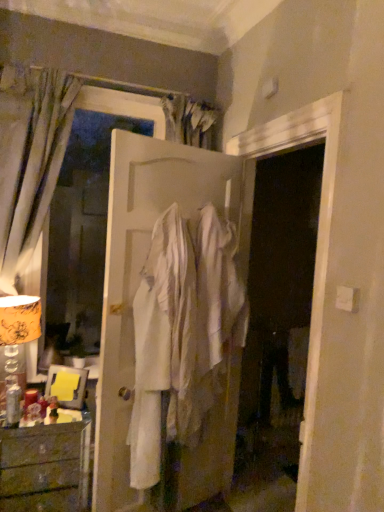
Identify the location of wooden chest of drawers at lower left. (45, 467).

You are a GUI agent. You are given a task and a screenshot of the screen. Output one action in this format:
    pyautogui.click(x=<x>, y=<y>)
    Task: Click on the gold-patterned fabric lampshade at left
    
    Given the screenshot: What is the action you would take?
    pyautogui.click(x=18, y=326)

Consider the image. How many degrees apart are the facing directions of gold-patterned fabric lampshade at left and white matte door at center?

The angular difference between gold-patterned fabric lampshade at left and white matte door at center is 17.2 degrees.

From a real-world perspective, which object rests below the other?

gold-patterned fabric lampshade at left.

Which is farther from the camera, (10, 357) or (203, 187)?

The point (10, 357) is behind.

Considering the positions of objects gold-patterned fabric lampshade at left and white matte door at center in the image provided, who is more to the right, gold-patterned fabric lampshade at left or white matte door at center?

white matte door at center is more to the right.

How many degrees apart are the facing directions of silky gray curtain at left and white matte door at center?

They differ by 17.8 degrees in their facing directions.

Could you tell me if silky gray curtain at left is turned towards white matte door at center?

No.

In the scene shown: Which of these two, silky gray curtain at left or white matte door at center, stands shorter?

silky gray curtain at left is shorter.

How far apart are silky gray curtain at left and white matte door at center?

62.93 centimeters.

Does silky gray curtain at left turn towards wooden chest of drawers at lower left?

No, silky gray curtain at left does not turn towards wooden chest of drawers at lower left.

Which of these two, silky gray curtain at left or wooden chest of drawers at lower left, is thinner?

silky gray curtain at left is thinner.

Can you confirm if silky gray curtain at left is shorter than wooden chest of drawers at lower left?

In fact, silky gray curtain at left may be taller than wooden chest of drawers at lower left.

Looking at this image, are silky gray curtain at left and wooden chest of drawers at lower left beside each other?

silky gray curtain at left and wooden chest of drawers at lower left are not in contact.

Where is `table lamp above the wooden chest of drawers at lower left (from a real-world perspective)`? The image size is (384, 512). table lamp above the wooden chest of drawers at lower left (from a real-world perspective) is located at coordinates (18, 326).

Considering the positions of objects wooden chest of drawers at lower left and gold-patterned fabric lampshade at left in the image provided, who is more to the right, wooden chest of drawers at lower left or gold-patterned fabric lampshade at left?

wooden chest of drawers at lower left.

From a real-world perspective, is wooden chest of drawers at lower left positioned above or below gold-patterned fabric lampshade at left?

From a real-world perspective, wooden chest of drawers at lower left is physically below gold-patterned fabric lampshade at left.

Does white matte door at center contain silky gray curtain at left?

No, silky gray curtain at left is not a part of white matte door at center.

In the image, is white matte door at center on the left side or the right side of silky gray curtain at left?

Based on their positions, white matte door at center is located to the right of silky gray curtain at left.

This screenshot has height=512, width=384. What are the coordinates of `curtain above the white matte door at center (from a real-world perspective)` in the screenshot? It's located at (31, 164).

Does white matte door at center touch silky gray curtain at left?

No, white matte door at center is not in contact with silky gray curtain at left.

Is wooden chest of drawers at lower left aimed at white matte door at center?

No, wooden chest of drawers at lower left is not oriented towards white matte door at center.

From a real-world perspective, which is physically below, wooden chest of drawers at lower left or white matte door at center?

wooden chest of drawers at lower left.

Between silky gray curtain at left and gold-patterned fabric lampshade at left, which one has more height?

silky gray curtain at left.

How different are the orientations of silky gray curtain at left and gold-patterned fabric lampshade at left in degrees?

The angle between the facing direction of silky gray curtain at left and the facing direction of gold-patterned fabric lampshade at left is 0.605 degrees.

The image size is (384, 512). In order to click on curtain lying above the gold-patterned fabric lampshade at left (from the image's perspective) in this screenshot , I will do `click(31, 164)`.

Is silky gray curtain at left bigger or smaller than gold-patterned fabric lampshade at left?

silky gray curtain at left is bigger than gold-patterned fabric lampshade at left.

Where is `table lamp that is on the left side of white matte door at center`? table lamp that is on the left side of white matte door at center is located at coordinates (18, 326).

The height and width of the screenshot is (512, 384). In order to click on door that is below the silky gray curtain at left (from the image's perspective) in this screenshot , I will do `click(138, 274)`.

Which object lies nearer to the anchor point wooden chest of drawers at lower left, silky gray curtain at left or white matte door at center?

The object closer to wooden chest of drawers at lower left is white matte door at center.

Which object lies further to the anchor point wooden chest of drawers at lower left, gold-patterned fabric lampshade at left or silky gray curtain at left?

The object further to wooden chest of drawers at lower left is silky gray curtain at left.

Based on their spatial positions, is silky gray curtain at left or wooden chest of drawers at lower left further from gold-patterned fabric lampshade at left?

wooden chest of drawers at lower left is positioned further to the anchor gold-patterned fabric lampshade at left.

From the image, which object appears to be farther from wooden chest of drawers at lower left, white matte door at center or silky gray curtain at left?

Among the two, silky gray curtain at left is located further to wooden chest of drawers at lower left.

When comparing their distances from gold-patterned fabric lampshade at left, does white matte door at center or wooden chest of drawers at lower left seem further?

Among the two, wooden chest of drawers at lower left is located further to gold-patterned fabric lampshade at left.

Which object lies further to the anchor point gold-patterned fabric lampshade at left, silky gray curtain at left or white matte door at center?

white matte door at center lies further to gold-patterned fabric lampshade at left than the other object.

Estimate the real-world distances between objects in this image. Which object is closer to gold-patterned fabric lampshade at left, wooden chest of drawers at lower left or silky gray curtain at left?

silky gray curtain at left.

From the image, which object appears to be farther from silky gray curtain at left, gold-patterned fabric lampshade at left or wooden chest of drawers at lower left?

wooden chest of drawers at lower left is further to silky gray curtain at left.

Locate an element on the screen. Image resolution: width=384 pixels, height=512 pixels. table lamp between silky gray curtain at left and wooden chest of drawers at lower left in the up-down direction is located at coordinates (18, 326).

Image resolution: width=384 pixels, height=512 pixels. I want to click on curtain located between gold-patterned fabric lampshade at left and white matte door at center in the left-right direction, so click(31, 164).

Find the location of a particular element. The height and width of the screenshot is (512, 384). door between silky gray curtain at left and wooden chest of drawers at lower left in the vertical direction is located at coordinates [x=138, y=274].

Find the location of a particular element. the chest of drawers located between gold-patterned fabric lampshade at left and white matte door at center in the left-right direction is located at coordinates (45, 467).